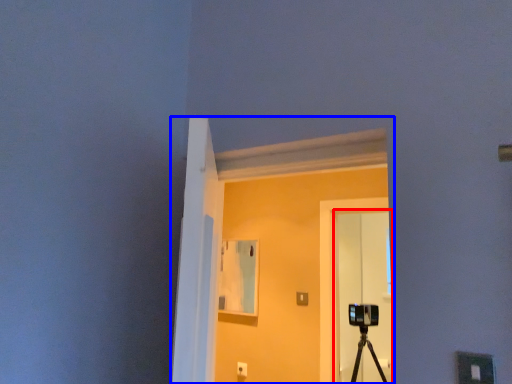
Question: Which object is closer to the camera taking this photo, glass door (highlighted by a red box) or window (highlighted by a blue box)?

Choices:
 (A) glass door
 (B) window

Answer: (B)